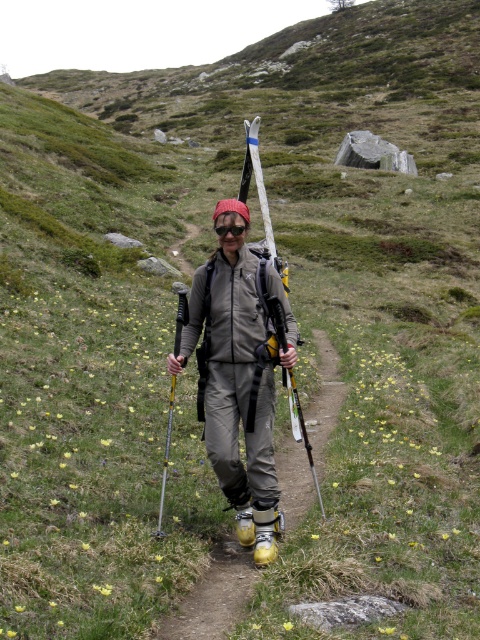
You are a hiker navigating a narrow dirt path through a grassy, hilly landscape. You see yellow rubber boots at center located at point (214, 596). Can you step on that point without stepping off the path?

The yellow rubber boots at center are located at point (214, 596), so yes, you can step on that point as it is within the path.

You are a hiker who just finished a trail and need to cross a small stream ahead. You see your yellow rubber boots at center and your white matte ski at center. Which item is easier to carry while crossing the stream?

The yellow rubber boots at center has a smaller size compared to the white matte ski at center, so it would be easier to carry while crossing the stream.